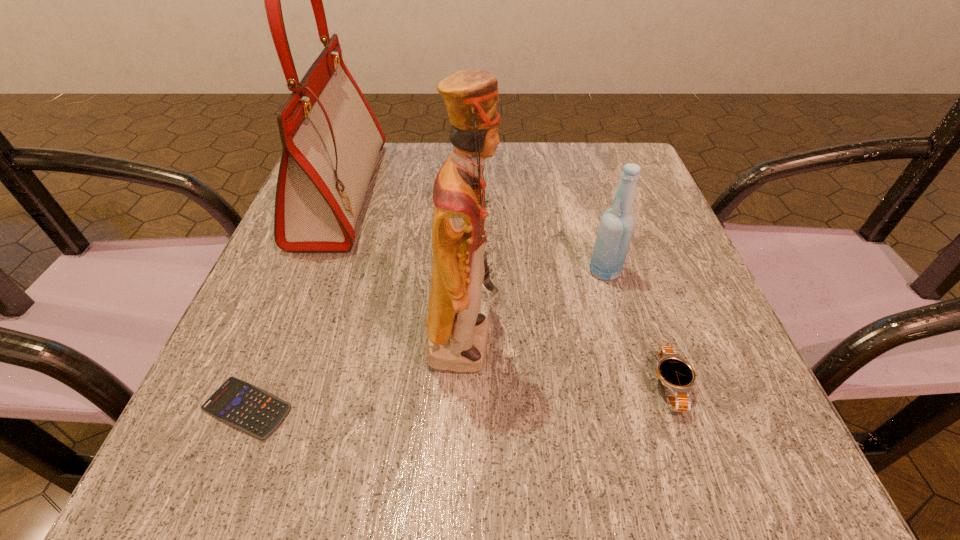
Locate an element on the screen. This screenshot has width=960, height=540. object present at the near left corner is located at coordinates (248, 408).

The image size is (960, 540). What are the coordinates of `free space at the far edge of the desktop` in the screenshot? It's located at (509, 173).

I want to click on vacant region at the near edge of the desktop, so click(x=313, y=462).

This screenshot has width=960, height=540. I want to click on free location at the left edge of the desktop, so click(278, 307).

Image resolution: width=960 pixels, height=540 pixels. In order to click on vacant space at the right edge of the desktop in this screenshot , I will do `click(679, 233)`.

Where is `vacant space at the far right corner of the desktop`? Image resolution: width=960 pixels, height=540 pixels. vacant space at the far right corner of the desktop is located at coordinates (601, 147).

Find the location of `free region at the near right corner`. free region at the near right corner is located at coordinates (738, 464).

You are a GUI agent. You are given a task and a screenshot of the screen. Output one action in this format:
    pyautogui.click(x=<x>, y=<y>)
    Task: Click on the free space between the fifth tallest object and the nutcracker
    
    Given the screenshot: What is the action you would take?
    pyautogui.click(x=567, y=362)

Where is `blank region between the watch and the compass`? This screenshot has height=540, width=960. blank region between the watch and the compass is located at coordinates (568, 296).

Locate an element on the screen. Image resolution: width=960 pixels, height=540 pixels. vacant space that's between the nutcracker and the fourth shortest object is located at coordinates [535, 305].